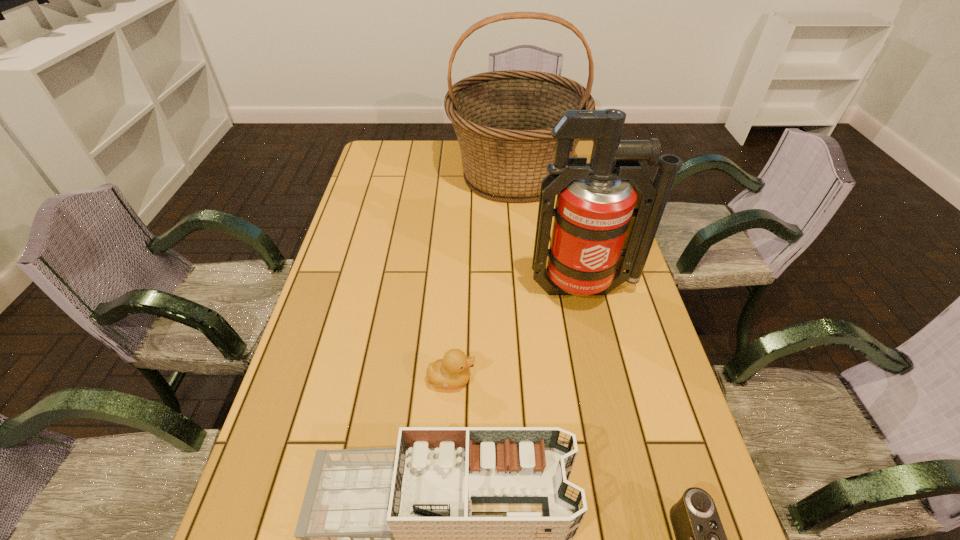
I want to click on the farthest object, so click(x=503, y=120).

The image size is (960, 540). What are the coordinates of `the second farthest object` in the screenshot? It's located at (602, 225).

Image resolution: width=960 pixels, height=540 pixels. In order to click on the third nearest object in this screenshot , I will do `click(451, 372)`.

Image resolution: width=960 pixels, height=540 pixels. What are the coordinates of `vacant space located 0.310m on the left of the basket` in the screenshot? It's located at (367, 174).

Locate an element on the screen. The width and height of the screenshot is (960, 540). free point located on the front label side of the fire extinguisher is located at coordinates (605, 382).

Where is `free spot located facing forward on the third farthest object`? The height and width of the screenshot is (540, 960). free spot located facing forward on the third farthest object is located at coordinates (555, 379).

Identify the location of object that is at the far edge. The height and width of the screenshot is (540, 960). (503, 120).

The height and width of the screenshot is (540, 960). I want to click on basket present at the right edge, so click(x=503, y=120).

The image size is (960, 540). I want to click on fire extinguisher that is at the right edge, so click(602, 225).

Identify the location of object that is at the far right corner. This screenshot has height=540, width=960. (503, 120).